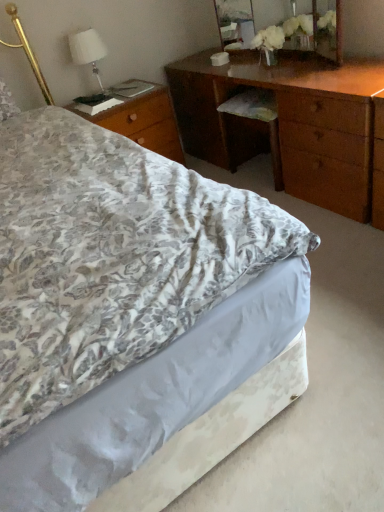
This screenshot has width=384, height=512. What are the coordinates of `wooden desk at center` in the screenshot? It's located at (287, 122).

Where is `floral fabric bed at center`? floral fabric bed at center is located at coordinates (125, 303).

The image size is (384, 512). What do you see at coordinates (125, 303) in the screenshot?
I see `floral fabric bed at center` at bounding box center [125, 303].

What do you see at coordinates (88, 50) in the screenshot? Image resolution: width=384 pixels, height=512 pixels. I see `white fabric lampshade at upper left` at bounding box center [88, 50].

Locate an element on the screen. The image size is (384, 512). wooden desk at center is located at coordinates (287, 122).

Are wooden nightstand at left and wooden desk at center located far from each other?

No.

Considering the sizes of objects wooden nightstand at left and wooden desk at center in the image provided, who is thinner, wooden nightstand at left or wooden desk at center?

Thinner between the two is wooden desk at center.

From the image's perspective, would you say wooden nightstand at left is positioned over wooden desk at center?

No.

Is floral fabric bed at center positioned far away from wooden nightstand at left?

Yes, floral fabric bed at center is far from wooden nightstand at left.

Which is in front, floral fabric bed at center or wooden nightstand at left?

Positioned in front is floral fabric bed at center.

Is floral fabric bed at center to the right of wooden nightstand at left from the viewer's perspective?

Indeed, floral fabric bed at center is positioned on the right side of wooden nightstand at left.

Looking at their sizes, would you say floral fabric bed at center is wider or thinner than wooden nightstand at left?

Clearly, floral fabric bed at center has more width compared to wooden nightstand at left.

This screenshot has height=512, width=384. Identify the location of desk below the wooden mirror at upper center (from a real-world perspective). (287, 122).

From the image's perspective, which one is positioned higher, wooden desk at center or wooden mirror at upper center?

From the image's view, wooden mirror at upper center is above.

Does wooden desk at center have a lesser height compared to wooden mirror at upper center?

Incorrect, the height of wooden desk at center does not fall short of that of wooden mirror at upper center.

Which is closer, (261, 132) or (220, 15)?

Point (261, 132) is closer to the camera than point (220, 15).

Looking at this image, is there a large distance between white fabric lampshade at upper left and floral fabric bed at center?

Indeed, white fabric lampshade at upper left is not near floral fabric bed at center.

Is the position of white fabric lampshade at upper left less distant than that of floral fabric bed at center?

No.

Looking at this image, does white fabric lampshade at upper left have a lesser width compared to floral fabric bed at center?

Yes, white fabric lampshade at upper left is thinner than floral fabric bed at center.

Considering the positions of points (97, 57) and (216, 244), is point (97, 57) farther from camera compared to point (216, 244)?

Yes.

Considering the relative sizes of wooden nightstand at left and white fabric lampshade at upper left in the image provided, is wooden nightstand at left smaller than white fabric lampshade at upper left?

Actually, wooden nightstand at left might be larger than white fabric lampshade at upper left.

From a real-world perspective, is wooden nightstand at left positioned above or below white fabric lampshade at upper left?

In terms of real-world spatial position, wooden nightstand at left is below white fabric lampshade at upper left.

Is wooden nightstand at left wider than white fabric lampshade at upper left?

Indeed, wooden nightstand at left has a greater width compared to white fabric lampshade at upper left.

Consider the image. Is the surface of wooden nightstand at left in direct contact with white fabric lampshade at upper left?

No, wooden nightstand at left is not with white fabric lampshade at upper left.

Which is further, (99,49) or (338,185)?

The point (99,49) is farther from the camera.

From a real-world perspective, is white fabric lampshade at upper left over wooden desk at center?

Yes, from a real-world perspective, white fabric lampshade at upper left is over wooden desk at center

Is white fabric lampshade at upper left in front of or behind wooden desk at center in the image?

Clearly, white fabric lampshade at upper left is behind wooden desk at center.

Can you confirm if white fabric lampshade at upper left is shorter than wooden desk at center?

Yes, white fabric lampshade at upper left is shorter than wooden desk at center.

Who is smaller, floral fabric bed at center or wooden mirror at upper center?

wooden mirror at upper center is smaller.

Which is more to the right, floral fabric bed at center or wooden mirror at upper center?

wooden mirror at upper center is more to the right.

Which object is wider, floral fabric bed at center or wooden mirror at upper center?

floral fabric bed at center is wider.

Identify the location of desk that appears above the wooden nightstand at left (from the image's perspective). Image resolution: width=384 pixels, height=512 pixels. (287, 122).

What are the coordinates of `bed that is below the wooden nightstand at left (from the image's perspective)` in the screenshot? It's located at (125, 303).

Estimate the real-world distances between objects in this image. Which object is further from white fabric lampshade at upper left, floral fabric bed at center or wooden mirror at upper center?

floral fabric bed at center lies further to white fabric lampshade at upper left than the other object.

Estimate the real-world distances between objects in this image. Which object is further from wooden desk at center, floral fabric bed at center or wooden nightstand at left?

floral fabric bed at center.

Which object lies further to the anchor point wooden nightstand at left, white fabric lampshade at upper left or wooden mirror at upper center?

wooden mirror at upper center.

Estimate the real-world distances between objects in this image. Which object is closer to floral fabric bed at center, wooden desk at center or wooden nightstand at left?

Based on the image, wooden nightstand at left appears to be nearer to floral fabric bed at center.

From the image, which object appears to be farther from wooden desk at center, wooden mirror at upper center or floral fabric bed at center?

Based on the image, floral fabric bed at center appears to be further to wooden desk at center.

Estimate the real-world distances between objects in this image. Which object is further from wooden desk at center, white fabric lampshade at upper left or floral fabric bed at center?

floral fabric bed at center lies further to wooden desk at center than the other object.

Considering their positions, is wooden mirror at upper center positioned further to white fabric lampshade at upper left than floral fabric bed at center?

Based on the image, floral fabric bed at center appears to be further to white fabric lampshade at upper left.

Which object lies further to the anchor point white fabric lampshade at upper left, wooden nightstand at left or wooden mirror at upper center?

The object further to white fabric lampshade at upper left is wooden mirror at upper center.

Locate an element on the screen. This screenshot has height=512, width=384. mirror between white fabric lampshade at upper left and wooden desk at center from left to right is located at coordinates (316, 31).

This screenshot has width=384, height=512. Identify the location of mirror between wooden nightstand at left and wooden desk at center from left to right. (316, 31).

Locate an element on the screen. This screenshot has width=384, height=512. mirror located between floral fabric bed at center and wooden nightstand at left in the depth direction is located at coordinates (316, 31).

Locate an element on the screen. The image size is (384, 512). nightstand situated between white fabric lampshade at upper left and wooden desk at center from left to right is located at coordinates (143, 122).